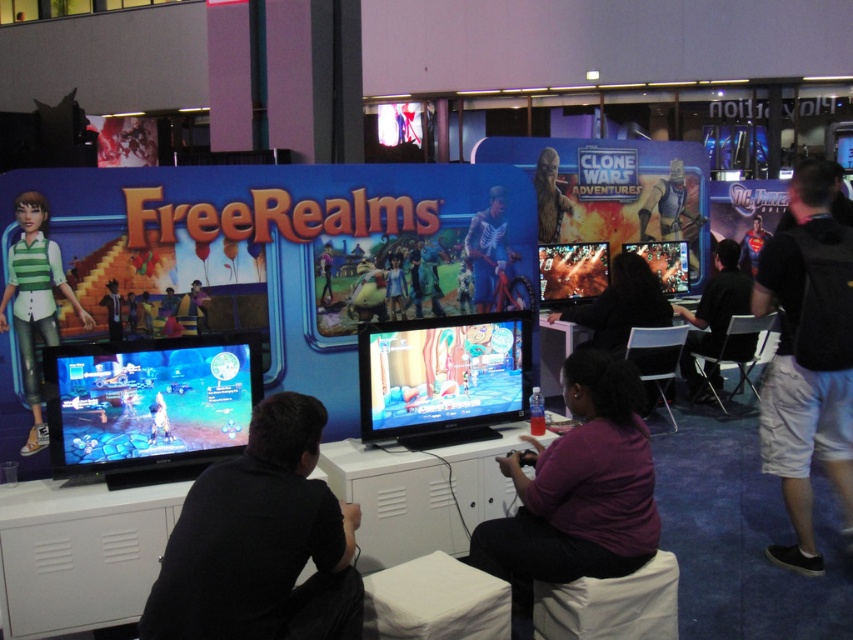
Question: Can you confirm if shiny blue screen at left is positioned below bone-patterned costume at center?

Choices:
 (A) no
 (B) yes

Answer: (B)

Question: Which point is farther to the camera?

Choices:
 (A) (621, 563)
 (B) (811, 356)
 (C) (466, 246)
 (D) (305, 492)

Answer: (C)

Question: Is the position of purple matte shirt at center more distant than that of shiny metallic figure at center?

Choices:
 (A) no
 (B) yes

Answer: (A)

Question: Which point is farther to the camera?

Choices:
 (A) black matte shirt at center
 (B) dark gray shirt at right
 (C) shiny metallic figure at center

Answer: (C)

Question: Among these points, which one is nearest to the camera?

Choices:
 (A) (39, 403)
 (B) (479, 269)
 (C) (138, 621)

Answer: (C)

Question: Does dark gray shirt at right appear on the left side of bone-patterned costume at center?

Choices:
 (A) no
 (B) yes

Answer: (A)